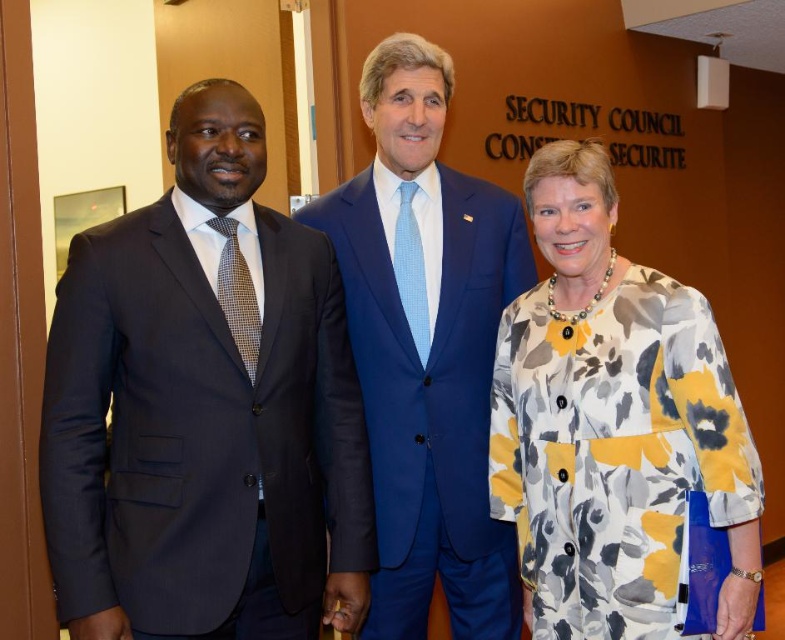
Question: Does matte black suit at left have a larger size compared to blue suit at center?

Choices:
 (A) yes
 (B) no

Answer: (A)

Question: Among these objects, which one is farthest from the camera?

Choices:
 (A) blue suit at center
 (B) matte black suit at left

Answer: (A)

Question: Which of these objects is positioned closest to the blue suit at center?

Choices:
 (A) matte black suit at left
 (B) floral-patterned dress at center

Answer: (B)

Question: Does matte black suit at left appear under blue suit at center?

Choices:
 (A) no
 (B) yes

Answer: (B)

Question: Is matte black suit at left above floral-patterned dress at center?

Choices:
 (A) yes
 (B) no

Answer: (A)

Question: Which point is closer to the camera taking this photo?

Choices:
 (A) (389, 227)
 (B) (751, 568)
 (C) (64, 321)

Answer: (C)